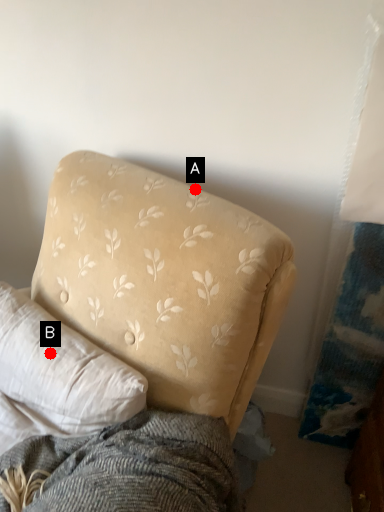
Question: Two points are circled on the image, labeled by A and B beside each circle. Among these points, which one is farthest from the camera?

Choices:
 (A) A is further
 (B) B is further

Answer: (A)